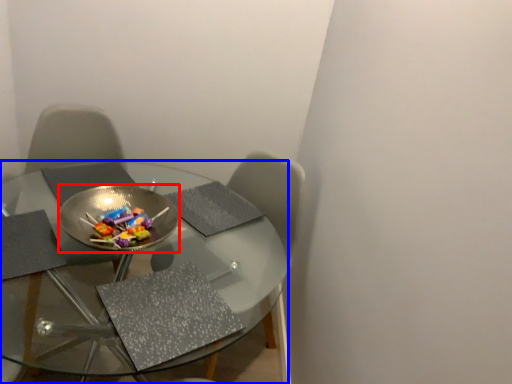
Question: Which point is closer to the camera, bowl (highlighted by a red box) or table (highlighted by a blue box)?

Choices:
 (A) bowl
 (B) table

Answer: (B)